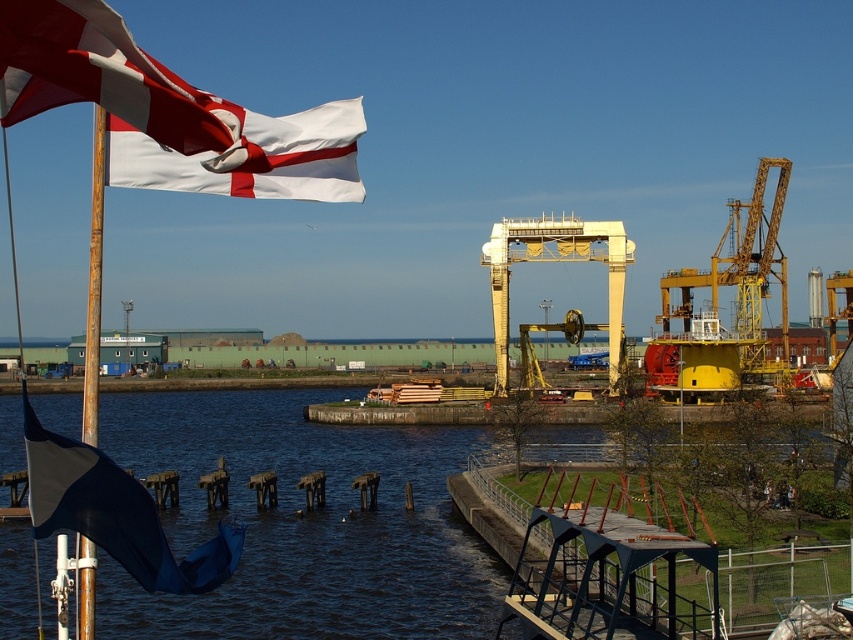
Question: Estimate the real-world distances between objects in this image. Which object is closer to the dark blue water at center?

Choices:
 (A) white fabric flag at upper left
 (B) blue fabric flag at left

Answer: (B)

Question: Is blue fabric flag at left positioned in front of yellow metallic crane at upper right?

Choices:
 (A) yes
 (B) no

Answer: (A)

Question: Can you confirm if dark blue water at center is smaller than yellow metallic crane at upper right?

Choices:
 (A) no
 (B) yes

Answer: (A)

Question: Which object appears closest to the camera in this image?

Choices:
 (A) blue fabric flag at left
 (B) yellow metallic crane at upper right

Answer: (A)

Question: Which of the following is the farthest from the observer?

Choices:
 (A) yellow metallic crane at upper right
 (B) blue fabric flag at left
 (C) dark blue water at center

Answer: (A)

Question: Is dark blue water at center thinner than blue fabric flag at left?

Choices:
 (A) yes
 (B) no

Answer: (B)